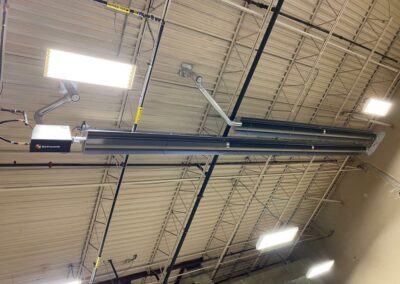
Where is `beige wall`? This screenshot has height=284, width=400. beige wall is located at coordinates (371, 248).